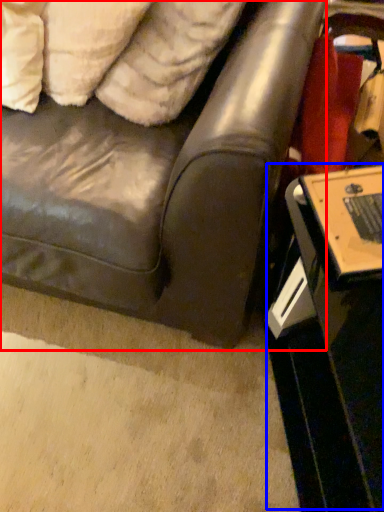
Question: Which object appears farthest to the camera in this image, studio couch (highlighted by a red box) or table (highlighted by a blue box)?

Choices:
 (A) studio couch
 (B) table

Answer: (B)